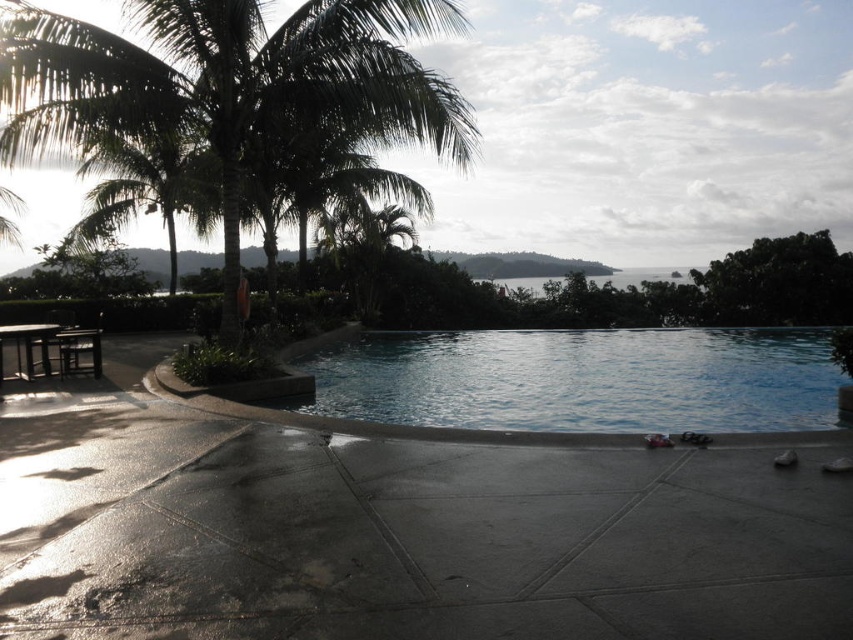
Question: Can you confirm if green leafy palm tree at upper left is positioned to the left of clear blue water at center?

Choices:
 (A) yes
 (B) no

Answer: (A)

Question: Is green leafy palm tree at upper left wider than clear blue water at center?

Choices:
 (A) no
 (B) yes

Answer: (A)

Question: In this image, where is green leafy palm tree at upper left located relative to clear blue water at center?

Choices:
 (A) left
 (B) right

Answer: (A)